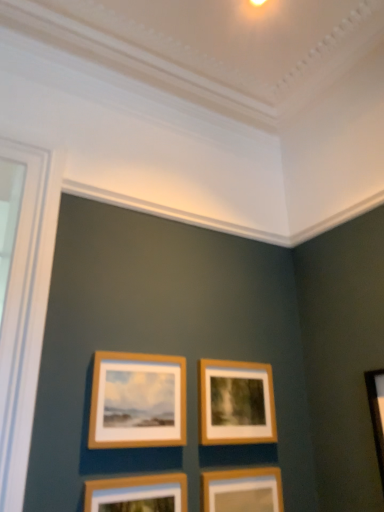
Question: In terms of width, does wooden picture frame at lower center, which ranks as the 2th picture frame in bottom-to-top order, look wider or thinner when compared to wooden frame at center, the second picture frame from the top?

Choices:
 (A) thin
 (B) wide

Answer: (B)

Question: From the image's perspective, is wooden picture frame at lower center, the third picture frame when ordered from top to bottom, positioned above or below wooden frame at center, which is the third picture frame from bottom to top?

Choices:
 (A) below
 (B) above

Answer: (A)

Question: Which is nearer to the wooden picture frame at lower center, the third picture frame when ordered from top to bottom?

Choices:
 (A) wooden frame at center, which ranks as the first picture frame in top-to-bottom order
 (B) wooden frame at center, which is the third picture frame from bottom to top
 (C) wooden picture frame at lower center, which is counted as the 1th picture frame, starting from the bottom

Answer: (A)

Question: Which object is the closest to the wooden frame at center, which is the third picture frame from bottom to top?

Choices:
 (A) wooden frame at center, which ranks as the first picture frame in top-to-bottom order
 (B) wooden picture frame at lower center, which ranks as the 2th picture frame in bottom-to-top order
 (C) wooden picture frame at lower center, which is counted as the 1th picture frame, starting from the bottom

Answer: (C)